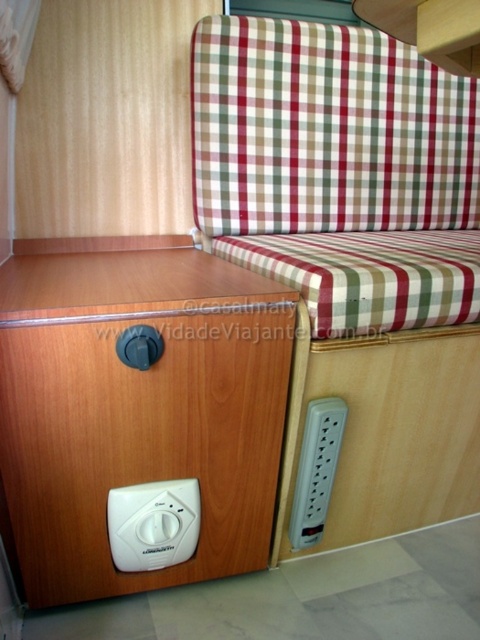
Question: Which of the following is the farthest from the observer?

Choices:
 (A) (28, 372)
 (B) (459, 376)

Answer: (B)

Question: Is white plastic thermostat at lower left closer to camera compared to white plastic power strip at lower center?

Choices:
 (A) yes
 (B) no

Answer: (A)

Question: Does checkered fabric couch at upper right come in front of white plastic power strip at lower center?

Choices:
 (A) yes
 (B) no

Answer: (A)

Question: Is white plastic thermostat at lower left bigger than white plastic power strip at lower center?

Choices:
 (A) no
 (B) yes

Answer: (A)

Question: Among these points, which one is nearest to the camera?

Choices:
 (A) (261, 428)
 (B) (177, 492)
 (C) (216, 241)
 (D) (304, 426)

Answer: (B)

Question: Which point is closer to the camera taking this photo?

Choices:
 (A) (326, 472)
 (B) (205, 506)

Answer: (B)